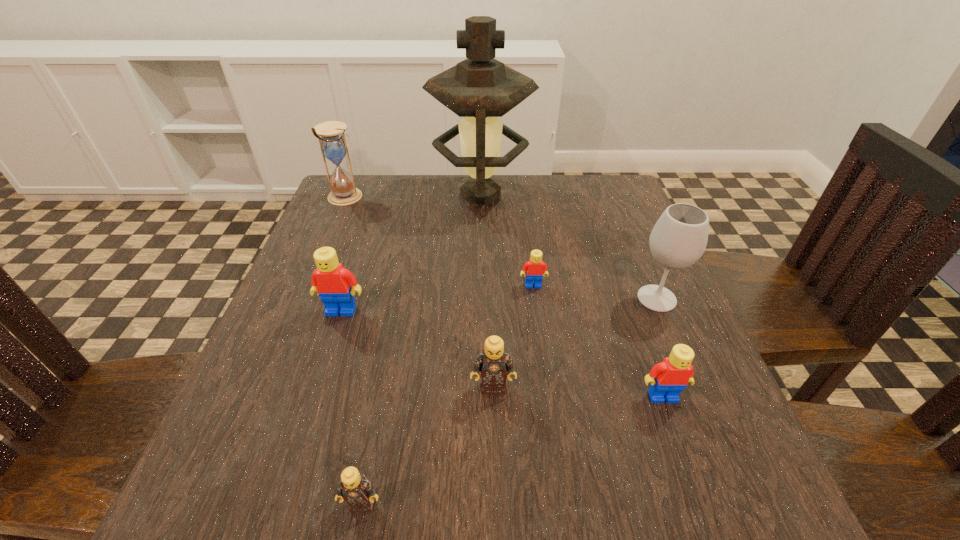
Where is `unoccupied area between the tallest object and the sixth object from right to left`? The width and height of the screenshot is (960, 540). unoccupied area between the tallest object and the sixth object from right to left is located at coordinates (421, 349).

You are a GUI agent. You are given a task and a screenshot of the screen. Output one action in this format:
    pyautogui.click(x=<x>, y=<y>)
    Task: Click on the free space between the rightmost Lego and the smallest red Lego
    
    Given the screenshot: What is the action you would take?
    pyautogui.click(x=598, y=341)

You are a GUI agent. You are given a task and a screenshot of the screen. Output one action in this format:
    pyautogui.click(x=<x>, y=<y>)
    Task: Click on the vacant area that lies between the wineglass and the fifth shortest object
    
    Given the screenshot: What is the action you would take?
    pyautogui.click(x=499, y=305)

Find the location of a particular element. blank region between the wineglass and the third Lego from left to right is located at coordinates (575, 343).

The image size is (960, 540). What are the coordinates of `unoccupied area between the right tan Lego and the leftmost red Lego` in the screenshot? It's located at (417, 349).

Locate which object ranks third in proximity to the rightmost red Lego. Please provide its 2D coordinates. Your answer should be formatted as a tuple, i.e. [(x, y)], where the tuple contains the x and y coordinates of a point satisfying the conditions above.

[(535, 268)]

Locate an element on the screen. the fifth closest object to the nearest object is located at coordinates (679, 238).

What are the coordinates of `Lego that stands as the second closest to the oil lamp` in the screenshot? It's located at (333, 282).

Identify the location of Lego that is the second nearest to the second nearest red Lego. (535, 268).

Locate which red Lego ranks in proximity to the farthest red Lego. Please provide its 2D coordinates. Your answer should be formatted as a tuple, i.e. [(x, y)], where the tuple contains the x and y coordinates of a point satisfying the conditions above.

[(668, 378)]